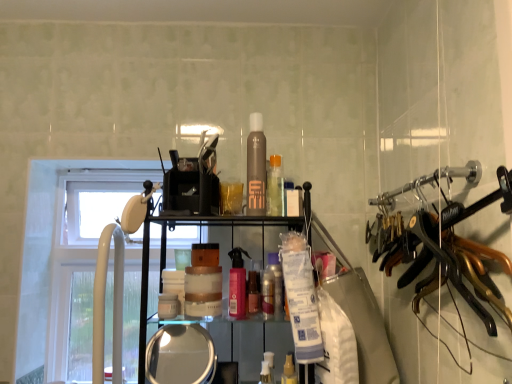
Question: Choose the correct answer: Is white plastic window at left inside white plastic faucet at left or outside it?

Choices:
 (A) outside
 (B) inside

Answer: (A)

Question: From the image's perspective, is white plastic window at left positioned above or below white plastic faucet at left?

Choices:
 (A) below
 (B) above

Answer: (A)

Question: Which object is positioned farthest from the white plastic faucet at left?

Choices:
 (A) matte gold jar at center, the 7th toiletry positioned from the right
 (B) metallic gold hangers at right
 (C) brown matte hair spray at center, the 4th toiletry when ordered from right to left
 (D) white matte bottle at center, which is the seventh toiletry in left-to-right order
 (E) translucent plastic bottle at center, which is counted as the third toiletry, starting from the right

Answer: (B)

Question: Estimate the real-world distances between objects in this image. Which object is closer to the white plastic window at left?

Choices:
 (A) translucent plastic bottle at center, which is counted as the third toiletry, starting from the right
 (B) translucent plastic spray bottle at center, placed as the fifth toiletry when sorted from right to left
 (C) matte gold jar at center, positioned as the 1th toiletry in left-to-right order
 (D) clear glass mirror at lower center
 (E) translucent plastic spray bottle at center, positioned as the sixth toiletry in left-to-right order

Answer: (D)